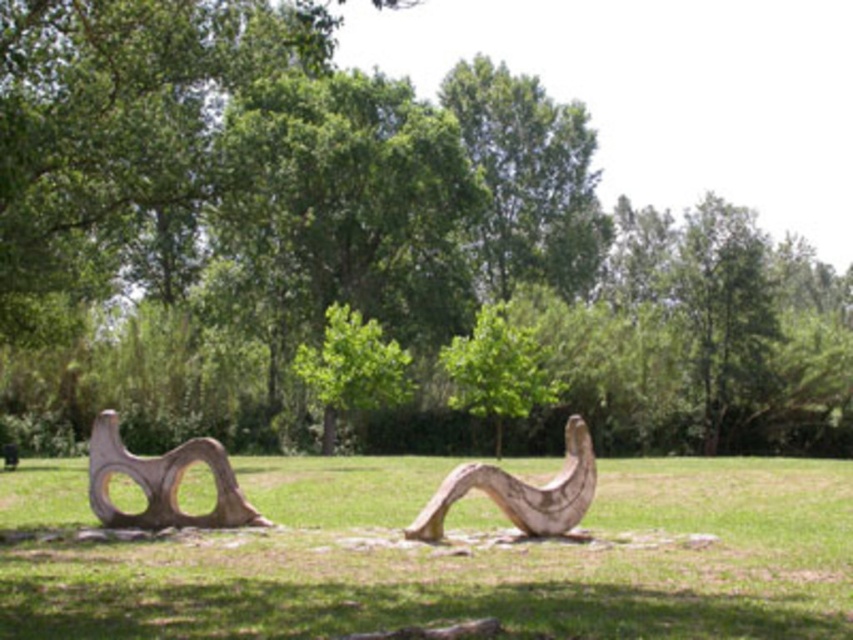
You are standing at the edge of the grassy field and want to place a 2.5 meter long wooden bench between the green grass at center and the natural wood sculpture at center. Will there be enough space to place the bench without it overlapping either object?

The distance between the green grass at center and the natural wood sculpture at center is 5.10 meters. Since the bench is 2.5 meters long, there is sufficient space to place it between them without overlapping either object.

You are standing in front of the two sculptures in the image. You notice two points marked on the sculptures. The first point is at coordinates point [334,448] and the second is at point [410,528]. Which point is closer to you?

Point [334,448] is closer to you because it is further to the viewer than point [410,528].

You are standing at the point marked as point (352, 368) in the image. Looking around, you see two sculptures and a green leafy tree. Which direction should you face to see the green leafy tree at center?

The green leafy tree at center is located at point (352, 368), so if you are standing at that point, you are already at the tree and facing any direction would allow you to see the sculptures around you.